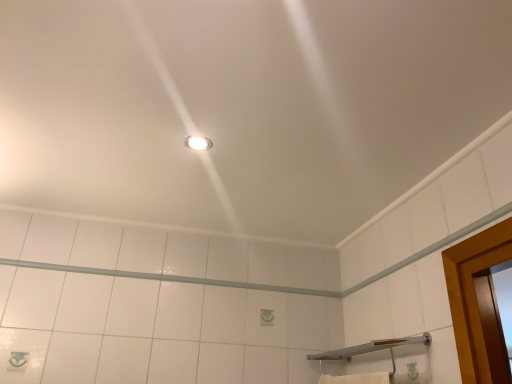
Question: Is matte white light fixture at center completely or partially inside silver metallic shower at lower right?

Choices:
 (A) no
 (B) yes

Answer: (A)

Question: From a real-world perspective, does silver metallic shower at lower right stand above matte white light fixture at center?

Choices:
 (A) yes
 (B) no

Answer: (B)

Question: Are silver metallic shower at lower right and matte white light fixture at center making contact?

Choices:
 (A) no
 (B) yes

Answer: (A)

Question: Considering the relative sizes of silver metallic shower at lower right and matte white light fixture at center in the image provided, is silver metallic shower at lower right taller than matte white light fixture at center?

Choices:
 (A) yes
 (B) no

Answer: (A)

Question: Is silver metallic shower at lower right to the right of matte white light fixture at center from the viewer's perspective?

Choices:
 (A) yes
 (B) no

Answer: (A)

Question: Considering the relative sizes of silver metallic shower at lower right and matte white light fixture at center in the image provided, is silver metallic shower at lower right smaller than matte white light fixture at center?

Choices:
 (A) no
 (B) yes

Answer: (A)

Question: Can you confirm if matte white light fixture at center is shorter than silver metallic shower at lower right?

Choices:
 (A) yes
 (B) no

Answer: (A)

Question: Is matte white light fixture at center to the left of silver metallic shower at lower right from the viewer's perspective?

Choices:
 (A) no
 (B) yes

Answer: (B)

Question: Considering the relative sizes of matte white light fixture at center and silver metallic shower at lower right in the image provided, is matte white light fixture at center bigger than silver metallic shower at lower right?

Choices:
 (A) no
 (B) yes

Answer: (A)

Question: From a real-world perspective, does matte white light fixture at center sit lower than silver metallic shower at lower right?

Choices:
 (A) yes
 (B) no

Answer: (B)

Question: Is matte white light fixture at center not inside silver metallic shower at lower right?

Choices:
 (A) yes
 (B) no

Answer: (A)

Question: Is matte white light fixture at center smaller than silver metallic shower at lower right?

Choices:
 (A) yes
 (B) no

Answer: (A)

Question: Considering the positions of silver metallic shower at lower right and matte white light fixture at center in the image, is silver metallic shower at lower right bigger or smaller than matte white light fixture at center?

Choices:
 (A) big
 (B) small

Answer: (A)